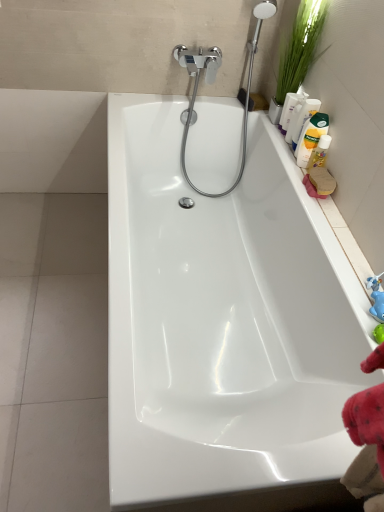
Question: Is white glossy bathtub at center further to the viewer compared to green leafy plant at upper right?

Choices:
 (A) no
 (B) yes

Answer: (A)

Question: Does white glossy bathtub at center have a smaller size compared to green leafy plant at upper right?

Choices:
 (A) no
 (B) yes

Answer: (A)

Question: Would you say white glossy bathtub at center is a long distance from green leafy plant at upper right?

Choices:
 (A) no
 (B) yes

Answer: (A)

Question: Is white glossy bathtub at center next to green leafy plant at upper right?

Choices:
 (A) no
 (B) yes

Answer: (A)

Question: From the image's perspective, does white glossy bathtub at center appear higher than green leafy plant at upper right?

Choices:
 (A) yes
 (B) no

Answer: (B)

Question: Considering the positions of green leafy plant at upper right and blue rubber toy at right in the image, is green leafy plant at upper right bigger or smaller than blue rubber toy at right?

Choices:
 (A) big
 (B) small

Answer: (A)

Question: Relative to blue rubber toy at right, is green leafy plant at upper right in front or behind?

Choices:
 (A) front
 (B) behind

Answer: (B)

Question: Is green leafy plant at upper right inside the boundaries of blue rubber toy at right, or outside?

Choices:
 (A) inside
 (B) outside

Answer: (B)

Question: Considering the positions of green leafy plant at upper right and blue rubber toy at right in the image, is green leafy plant at upper right taller or shorter than blue rubber toy at right?

Choices:
 (A) tall
 (B) short

Answer: (A)

Question: Considering the positions of yellow liquid bottle at upper right, which ranks as the second cleaning product in bottom-to-top order, and green leafy plant at upper right in the image, is yellow liquid bottle at upper right, which ranks as the second cleaning product in bottom-to-top order, bigger or smaller than green leafy plant at upper right?

Choices:
 (A) big
 (B) small

Answer: (B)

Question: Is point (312, 139) closer or farther from the camera than point (291, 29)?

Choices:
 (A) closer
 (B) farther

Answer: (A)

Question: Considering the positions of yellow liquid bottle at upper right, arranged as the third cleaning product when viewed from the top, and green leafy plant at upper right in the image, is yellow liquid bottle at upper right, arranged as the third cleaning product when viewed from the top, wider or thinner than green leafy plant at upper right?

Choices:
 (A) thin
 (B) wide

Answer: (A)

Question: Considering the relative positions of yellow liquid bottle at upper right, arranged as the third cleaning product when viewed from the top, and green leafy plant at upper right in the image provided, is yellow liquid bottle at upper right, arranged as the third cleaning product when viewed from the top, to the left or to the right of green leafy plant at upper right?

Choices:
 (A) right
 (B) left

Answer: (A)

Question: From a real-world perspective, is yellow matte bottle at upper right, the first cleaning product from the top, above or below green leafy plant at upper right?

Choices:
 (A) above
 (B) below

Answer: (B)

Question: In terms of width, does yellow matte bottle at upper right, the 4th cleaning product when ordered from bottom to top, look wider or thinner when compared to green leafy plant at upper right?

Choices:
 (A) wide
 (B) thin

Answer: (B)